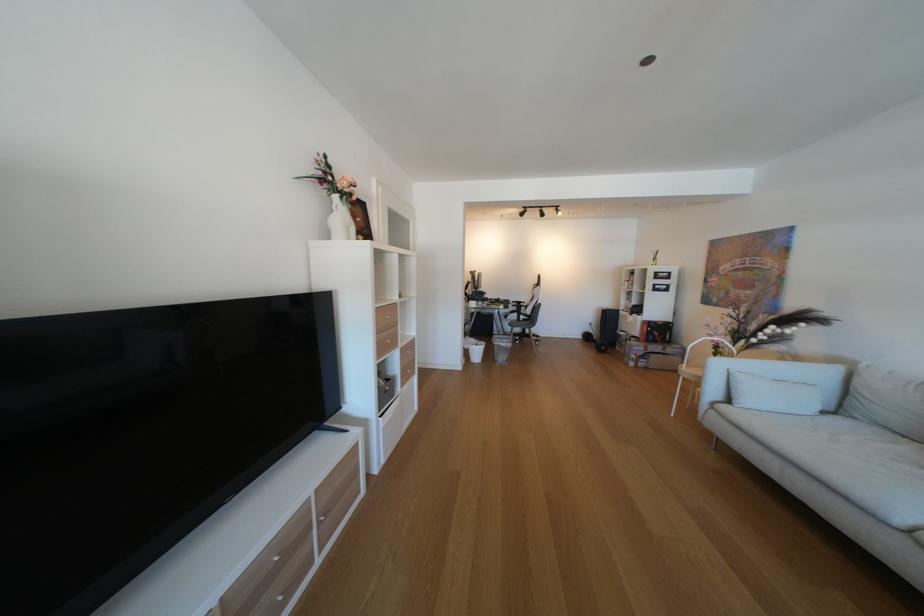
Describe the element at coordinates (384, 390) in the screenshot. I see `the grey box handle` at that location.